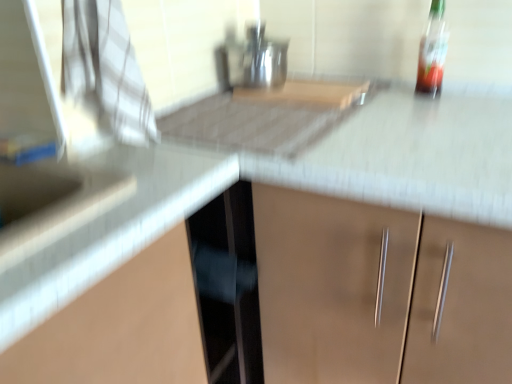
Question: Is point (151, 162) positioned closer to the camera than point (434, 84)?

Choices:
 (A) farther
 (B) closer

Answer: (B)

Question: Is white glossy counter top at upper left taller or shorter than translucent glass bottle at upper right?

Choices:
 (A) short
 (B) tall

Answer: (A)

Question: From a real-world perspective, is white glossy counter top at upper left physically located above or below translucent glass bottle at upper right?

Choices:
 (A) above
 (B) below

Answer: (B)

Question: From a real-world perspective, is translucent glass bottle at upper right positioned above or below white glossy counter top at upper left?

Choices:
 (A) below
 (B) above

Answer: (B)

Question: Is translucent glass bottle at upper right inside or outside of white glossy counter top at upper left?

Choices:
 (A) outside
 (B) inside

Answer: (A)

Question: In terms of height, does translucent glass bottle at upper right look taller or shorter compared to white glossy counter top at upper left?

Choices:
 (A) tall
 (B) short

Answer: (A)

Question: Is point (435, 74) positioned closer to the camera than point (170, 162)?

Choices:
 (A) closer
 (B) farther

Answer: (B)